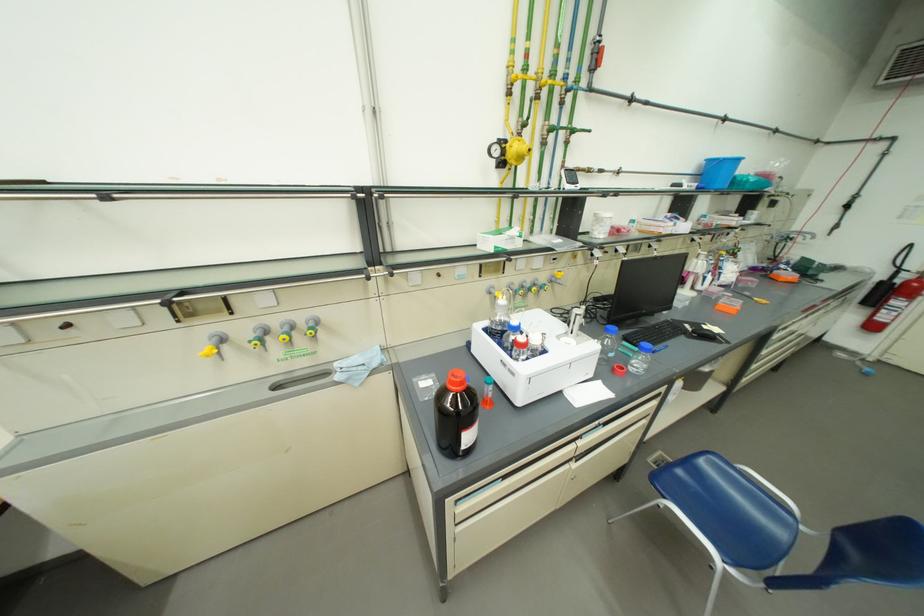
Where is `yellow valve handle`? This screenshot has width=924, height=616. yellow valve handle is located at coordinates (213, 345).